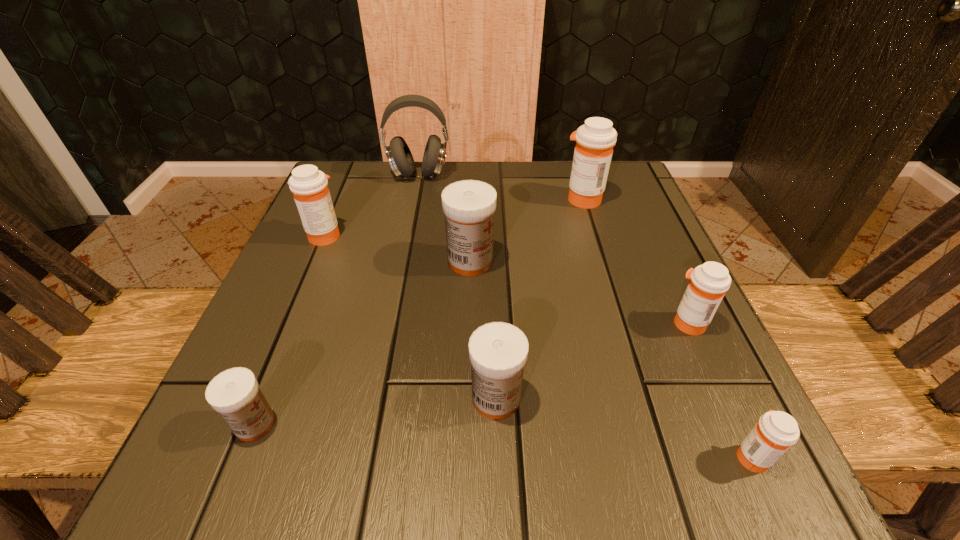
Where is `vacant position in the image that satisfies the following two spatial constraints: 1. on the ear cups of the biggest white medicine; 2. on the right side of the third object from left to right`? vacant position in the image that satisfies the following two spatial constraints: 1. on the ear cups of the biggest white medicine; 2. on the right side of the third object from left to right is located at coordinates (401, 261).

Image resolution: width=960 pixels, height=540 pixels. In order to click on free location that satisfies the following two spatial constraints: 1. on the ear cups of the smallest orange medicine; 2. on the left side of the third object from left to right in this screenshot , I will do `click(363, 456)`.

Locate an element on the screen. vacant region that satisfies the following two spatial constraints: 1. on the ear cups of the third object from left to right; 2. on the right side of the tallest medicine is located at coordinates (414, 199).

Where is `free space that satisfies the following two spatial constraints: 1. on the ear cups of the headset; 2. on the right side of the second biggest white medicine`? The height and width of the screenshot is (540, 960). free space that satisfies the following two spatial constraints: 1. on the ear cups of the headset; 2. on the right side of the second biggest white medicine is located at coordinates (374, 398).